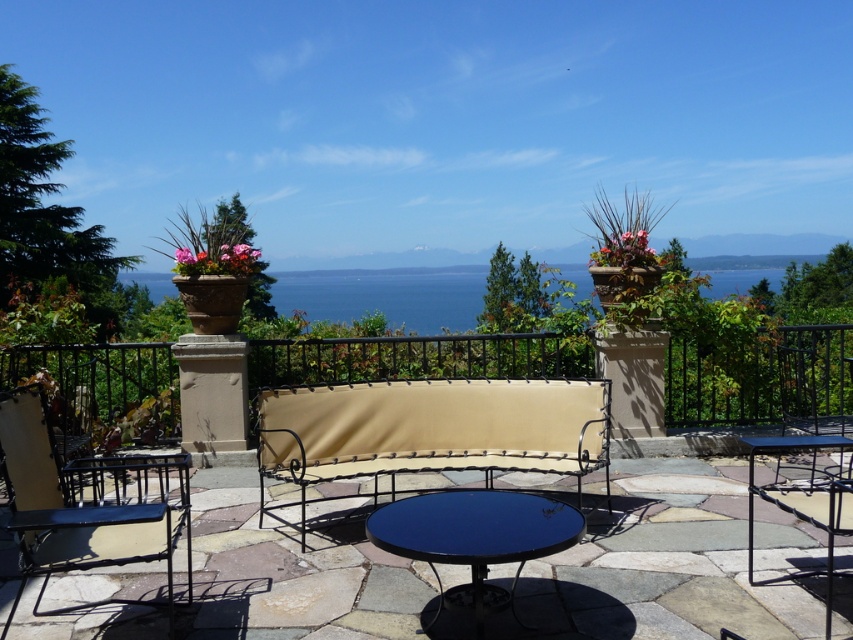
Which is more to the right, metallic wrought iron bench at center or metallic black chair at lower left?

From the viewer's perspective, metallic wrought iron bench at center appears more on the right side.

Who is more distant from viewer, (392, 605) or (99, 484)?

Positioned behind is point (99, 484).

Which is in front, point (732, 538) or point (146, 518)?

Point (146, 518) is in front.

This screenshot has height=640, width=853. Identify the location of metallic wrought iron bench at center. (659, 563).

Which is in front, point (492, 458) or point (440, 595)?

Point (440, 595) is more forward.

Between point (422, 570) and point (498, 518), which one is positioned behind?

The point (422, 570) is more distant.

Where is `metallic wrought iron bench at center`? The width and height of the screenshot is (853, 640). metallic wrought iron bench at center is located at coordinates (659, 563).

At what (x,y) coordinates should I click in order to perform the action: click on metallic wrought iron bench at center. Please return your answer as a coordinate pair (x, y). The image size is (853, 640). Looking at the image, I should click on (659, 563).

Is glossy black table at center wider than metallic black chair at right?

Indeed, glossy black table at center has a greater width compared to metallic black chair at right.

Measure the distance between point (480, 580) and camera.

The distance of point (480, 580) from camera is 10.88 feet.

You are a GUI agent. You are given a task and a screenshot of the screen. Output one action in this format:
    pyautogui.click(x=<x>, y=<y>)
    Task: Click on the glossy black table at center
    The height and width of the screenshot is (640, 853).
    Given the screenshot: What is the action you would take?
    pyautogui.click(x=474, y=538)